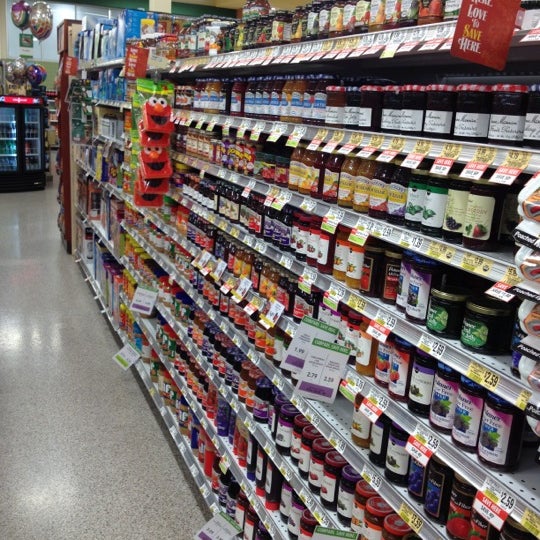
Locate an element on the screen. The image size is (540, 540). toy is located at coordinates (155, 117).